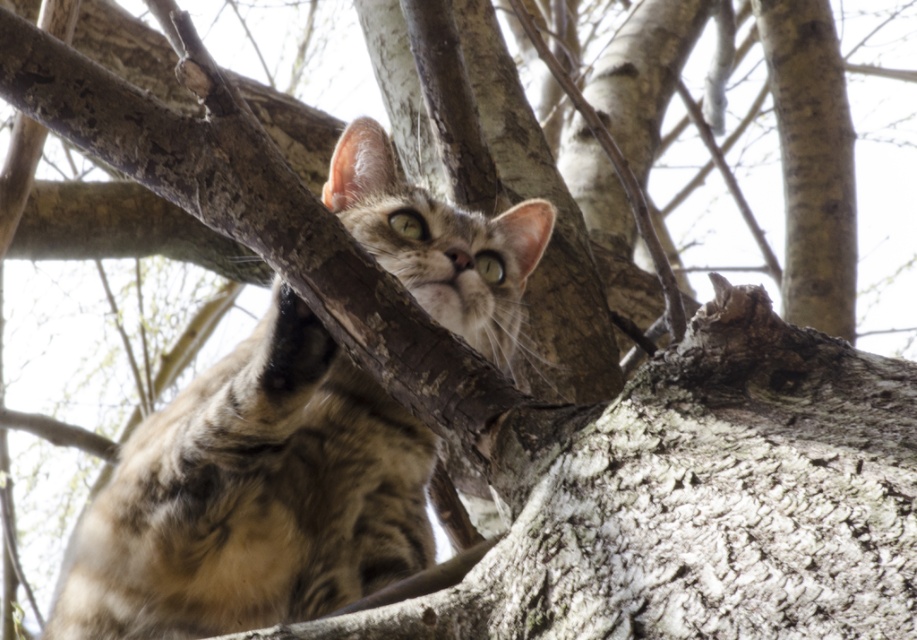
Question: Is tabby fur cat at center above smooth gray bark at upper right?

Choices:
 (A) no
 (B) yes

Answer: (A)

Question: Can you confirm if tabby fur cat at center is smaller than smooth gray bark at upper right?

Choices:
 (A) no
 (B) yes

Answer: (A)

Question: Among these points, which one is farthest from the camera?

Choices:
 (A) (341, 515)
 (B) (780, 113)

Answer: (B)

Question: In this image, where is tabby fur cat at center located relative to smooth gray bark at upper right?

Choices:
 (A) below
 (B) above

Answer: (A)